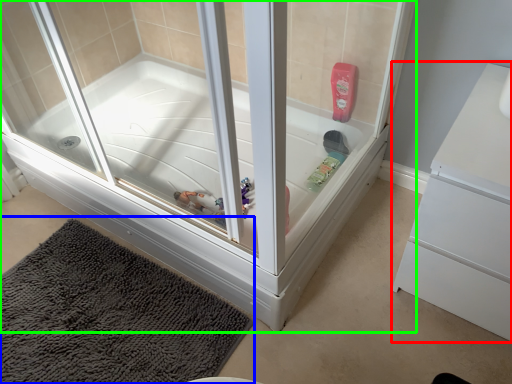
Question: Based on their relative distances, which object is farther from dresser (highlighted by a red box)? Choose from bath mat (highlighted by a blue box) and bathtub (highlighted by a green box).

Choices:
 (A) bath mat
 (B) bathtub

Answer: (A)